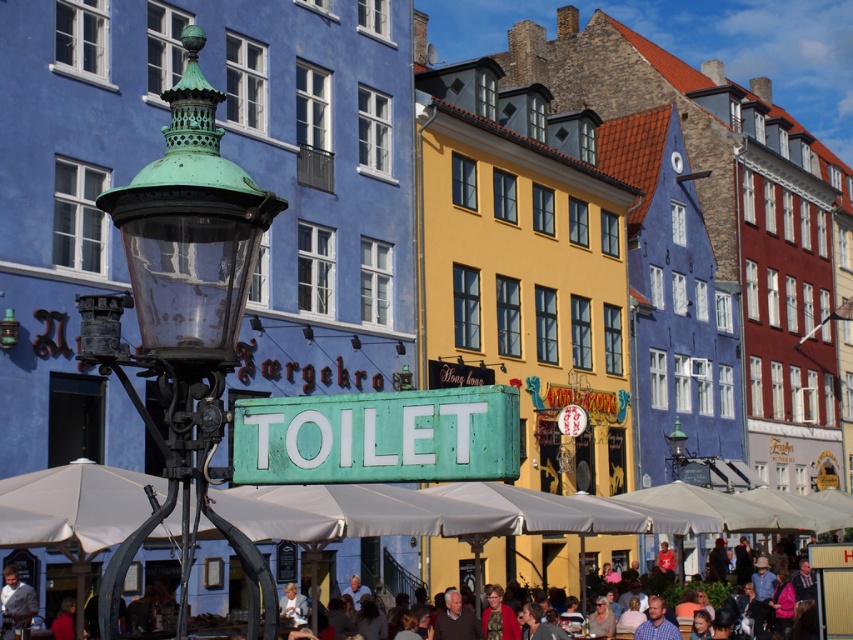
Based on the photo, you are a tourist standing on the street looking at the green matte toilet sign at center and the light brown wooden chair at lower center. Which object is higher up in the image?

The green matte toilet sign at center is higher up in the image than the light brown wooden chair at lower center.